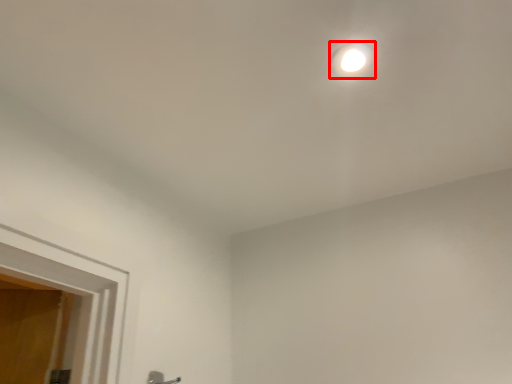
Question: From the image's perspective, considering the relative positions of droplight (annotated by the red box) and door handle in the image provided, where is droplight (annotated by the red box) located with respect to the staircase?

Choices:
 (A) above
 (B) below

Answer: (A)